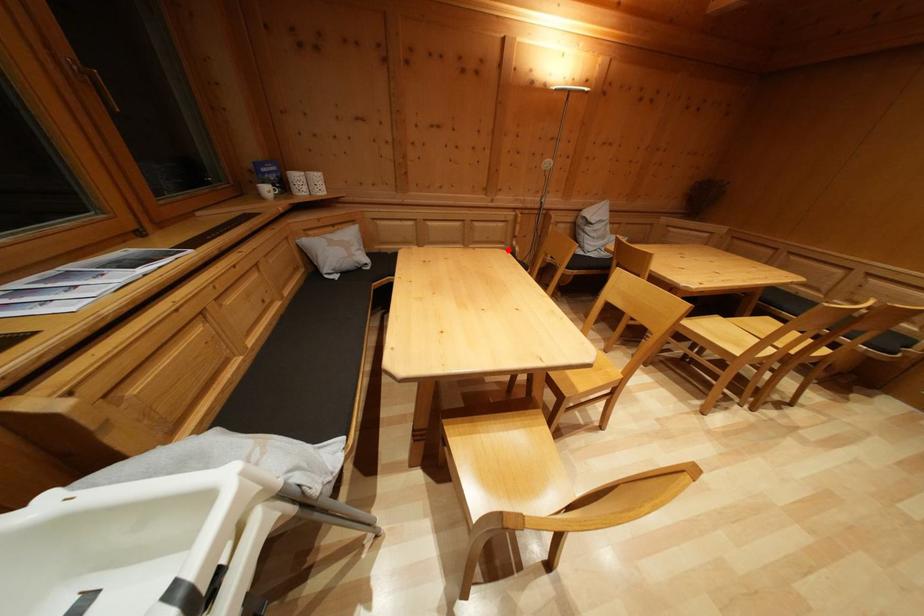
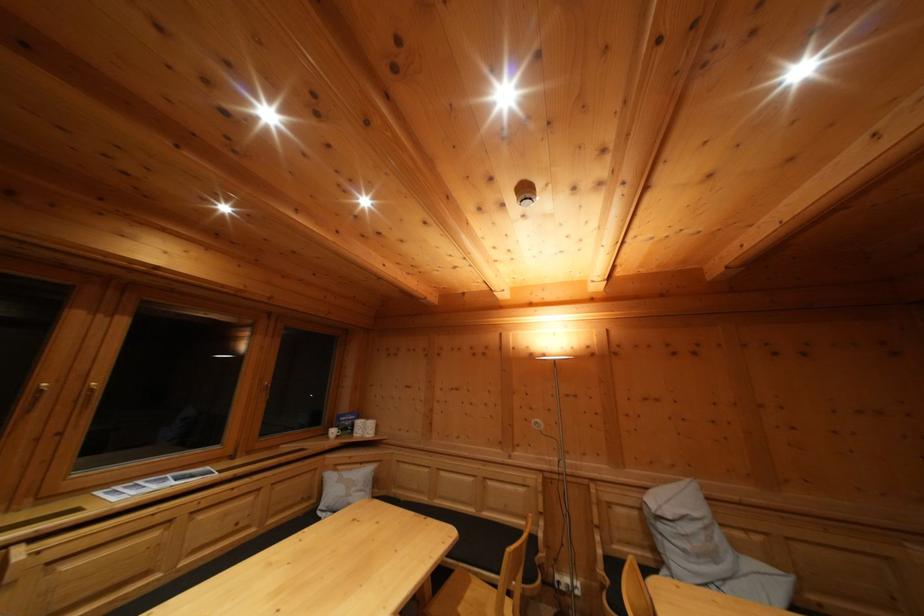
Question: I am providing you with two images of the same scene from different viewpoints. Given a red point in image1, look at the same physical point in image2. Is it:

Choices:
 (A) Closer to the viewpoint
 (B) Farther from the viewpoint

Answer: (B)